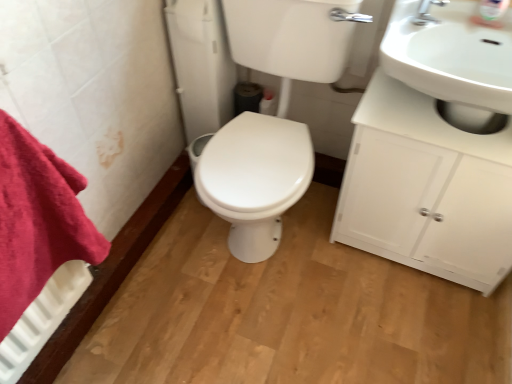
Question: Can you confirm if red cotton towel at left is bigger than silver metallic faucet at upper right?

Choices:
 (A) yes
 (B) no

Answer: (A)

Question: Can you confirm if red cotton towel at left is taller than silver metallic faucet at upper right?

Choices:
 (A) no
 (B) yes

Answer: (B)

Question: Is the position of red cotton towel at left more distant than that of silver metallic faucet at upper right?

Choices:
 (A) yes
 (B) no

Answer: (B)

Question: Can you confirm if red cotton towel at left is positioned to the left of silver metallic faucet at upper right?

Choices:
 (A) no
 (B) yes

Answer: (B)

Question: Considering the relative positions of red cotton towel at left and silver metallic faucet at upper right in the image provided, is red cotton towel at left to the right of silver metallic faucet at upper right from the viewer's perspective?

Choices:
 (A) yes
 (B) no

Answer: (B)

Question: Does red cotton towel at left contain silver metallic faucet at upper right?

Choices:
 (A) no
 (B) yes

Answer: (A)

Question: Is white glossy toilet at center aimed at silver metallic faucet at upper right?

Choices:
 (A) no
 (B) yes

Answer: (A)

Question: Is the surface of white glossy toilet at center in direct contact with silver metallic faucet at upper right?

Choices:
 (A) no
 (B) yes

Answer: (A)

Question: Considering the relative sizes of white glossy toilet at center and silver metallic faucet at upper right in the image provided, is white glossy toilet at center wider than silver metallic faucet at upper right?

Choices:
 (A) no
 (B) yes

Answer: (B)

Question: Is white glossy toilet at center positioned with its back to silver metallic faucet at upper right?

Choices:
 (A) no
 (B) yes

Answer: (A)

Question: From a real-world perspective, is white glossy toilet at center below silver metallic faucet at upper right?

Choices:
 (A) no
 (B) yes

Answer: (B)

Question: Considering the relative sizes of white glossy toilet at center and silver metallic faucet at upper right in the image provided, is white glossy toilet at center smaller than silver metallic faucet at upper right?

Choices:
 (A) yes
 (B) no

Answer: (B)

Question: Can you confirm if white glossy cabinet at right is thinner than red cotton towel at left?

Choices:
 (A) yes
 (B) no

Answer: (B)